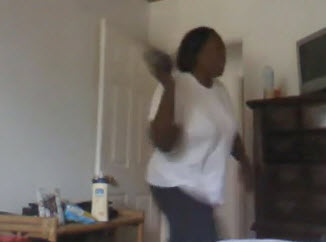
Locate an element on the screen. tv is located at coordinates (318, 46).